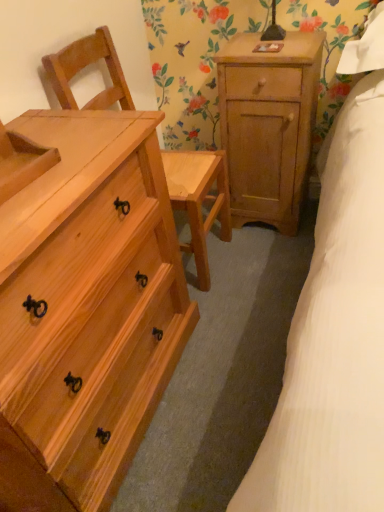
Question: Considering the relative sizes of natural wood chest of drawers at left and natural wood nightstand at upper right in the image provided, is natural wood chest of drawers at left bigger than natural wood nightstand at upper right?

Choices:
 (A) yes
 (B) no

Answer: (A)

Question: From the image's perspective, would you say natural wood chest of drawers at left is positioned over natural wood nightstand at upper right?

Choices:
 (A) no
 (B) yes

Answer: (A)

Question: Is natural wood chest of drawers at left aimed at natural wood nightstand at upper right?

Choices:
 (A) yes
 (B) no

Answer: (B)

Question: From a real-world perspective, is natural wood chest of drawers at left positioned over natural wood nightstand at upper right based on gravity?

Choices:
 (A) no
 (B) yes

Answer: (B)

Question: Is natural wood chest of drawers at left positioned behind natural wood nightstand at upper right?

Choices:
 (A) no
 (B) yes

Answer: (A)

Question: From the image's perspective, is natural wood chest of drawers at left under natural wood nightstand at upper right?

Choices:
 (A) no
 (B) yes

Answer: (B)

Question: Can you confirm if natural wood chair at left is bigger than natural wood nightstand at upper right?

Choices:
 (A) yes
 (B) no

Answer: (A)

Question: Does natural wood chair at left come in front of natural wood nightstand at upper right?

Choices:
 (A) no
 (B) yes

Answer: (B)

Question: Considering the relative sizes of natural wood chair at left and natural wood nightstand at upper right in the image provided, is natural wood chair at left smaller than natural wood nightstand at upper right?

Choices:
 (A) yes
 (B) no

Answer: (B)

Question: Can you confirm if natural wood chair at left is positioned to the left of natural wood nightstand at upper right?

Choices:
 (A) yes
 (B) no

Answer: (A)

Question: Is natural wood chair at left positioned with its back to natural wood nightstand at upper right?

Choices:
 (A) no
 (B) yes

Answer: (A)

Question: Considering the relative sizes of natural wood chair at left and natural wood nightstand at upper right in the image provided, is natural wood chair at left taller than natural wood nightstand at upper right?

Choices:
 (A) no
 (B) yes

Answer: (B)

Question: Is the position of natural wood nightstand at upper right less distant than that of natural wood chair at left?

Choices:
 (A) no
 (B) yes

Answer: (A)